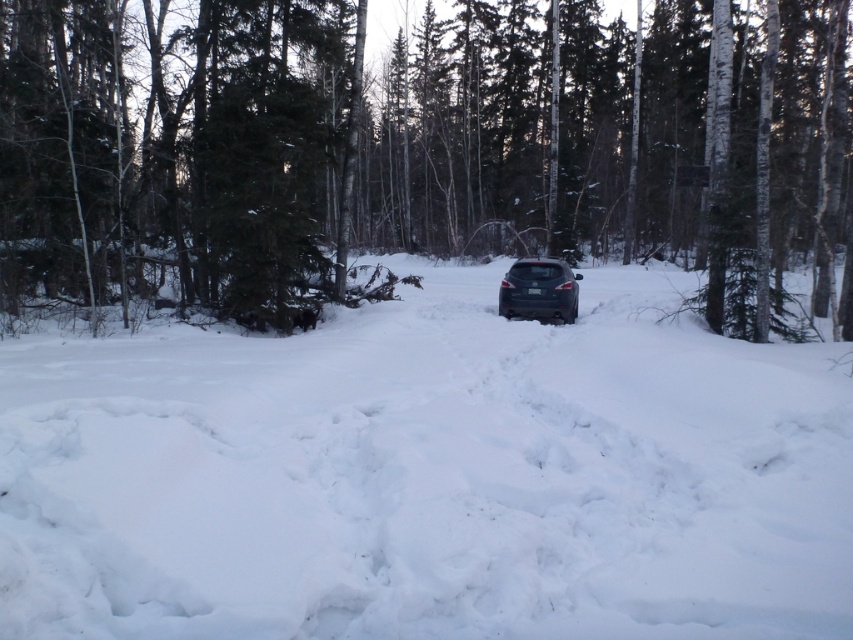
Which is behind, point (94, 502) or point (233, 42)?

The point (233, 42) is more distant.

Who is higher up, white fluffy snow at center or green textured pine tree at center?

Positioned higher is green textured pine tree at center.

At what (x,y) coordinates should I click in order to perform the action: click on white fluffy snow at center. Please return your answer as a coordinate pair (x, y). Looking at the image, I should click on (428, 476).

Who is more distant from viewer, (276, 138) or (515, 282)?

Positioned behind is point (515, 282).

This screenshot has height=640, width=853. What do you see at coordinates (421, 148) in the screenshot?
I see `green textured pine tree at center` at bounding box center [421, 148].

What do you see at coordinates (421, 148) in the screenshot? This screenshot has height=640, width=853. I see `green textured pine tree at center` at bounding box center [421, 148].

I want to click on green textured pine tree at center, so click(421, 148).

Does point (140, 360) lie in front of point (543, 298)?

Yes, it is.

Is the position of white fluffy snow at center more distant than that of satin black car at center?

No, white fluffy snow at center is in front of satin black car at center.

Where is `white fluffy snow at center`? white fluffy snow at center is located at coordinates (428, 476).

Image resolution: width=853 pixels, height=640 pixels. What are the coordinates of `white fluffy snow at center` in the screenshot? It's located at (428, 476).